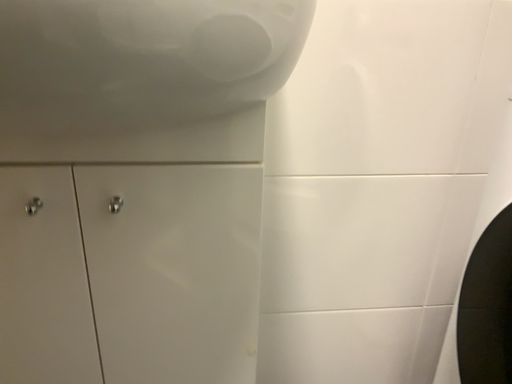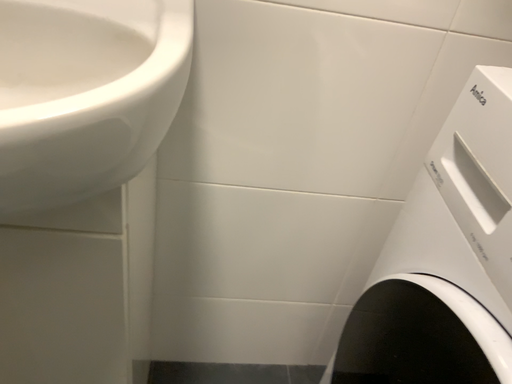
Question: Which way did the camera rotate in the video?

Choices:
 (A) rotated upward
 (B) rotated downward

Answer: (B)